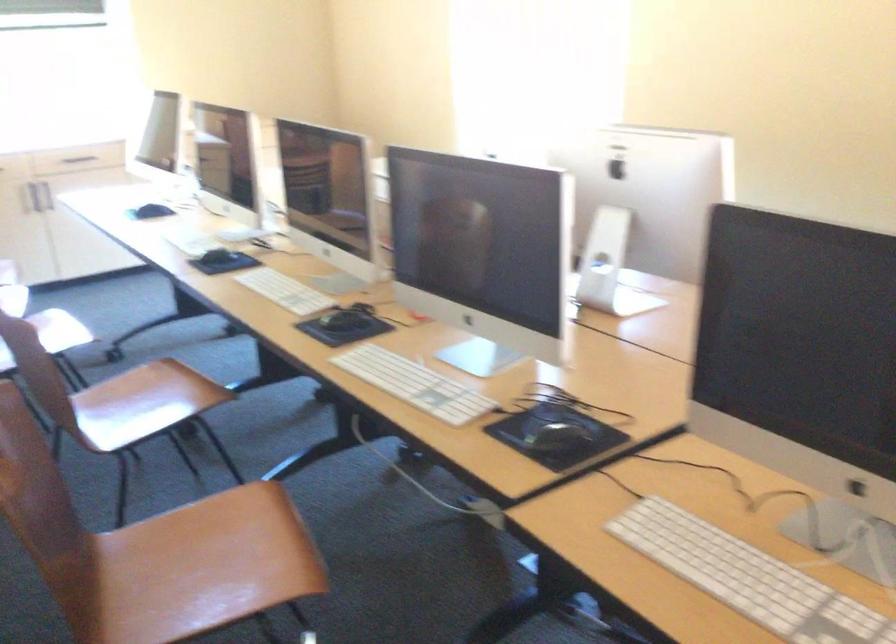
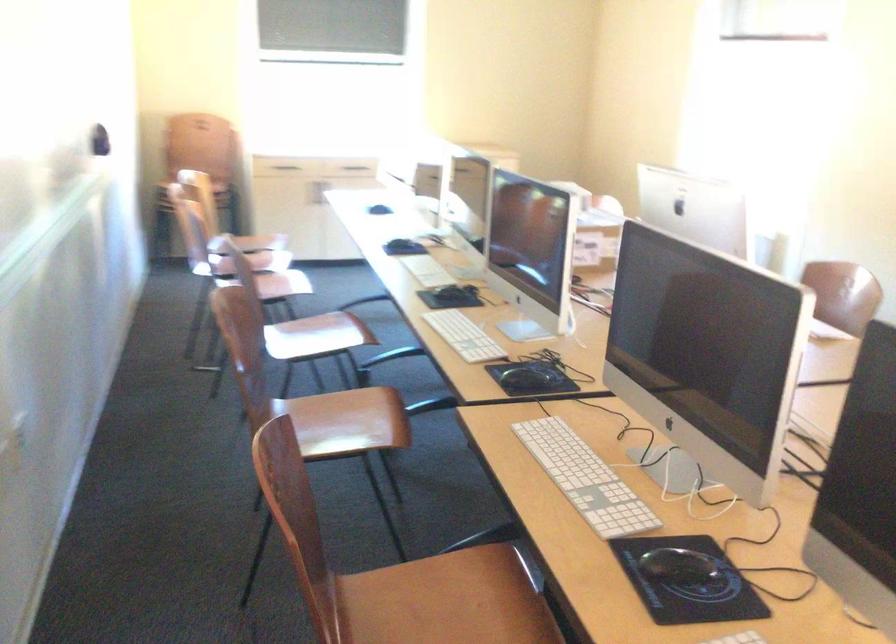
In a continuous first-person perspective shot, in which direction is the camera moving?

The movement direction of the cameraman is right, backward.